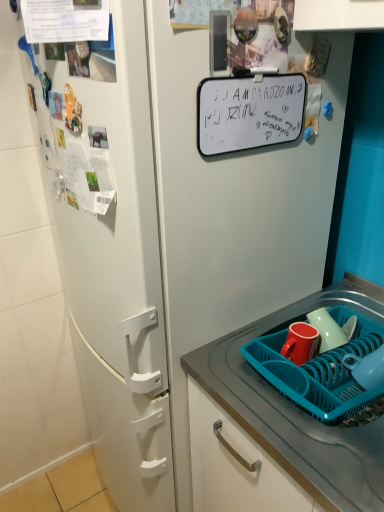
You are a GUI agent. You are given a task and a screenshot of the screen. Output one action in this format:
    pyautogui.click(x=<x>, y=<y>)
    Task: Click on the free space in front of glossy ceramic mug at lower right
    
    Given the screenshot: What is the action you would take?
    pyautogui.click(x=326, y=388)